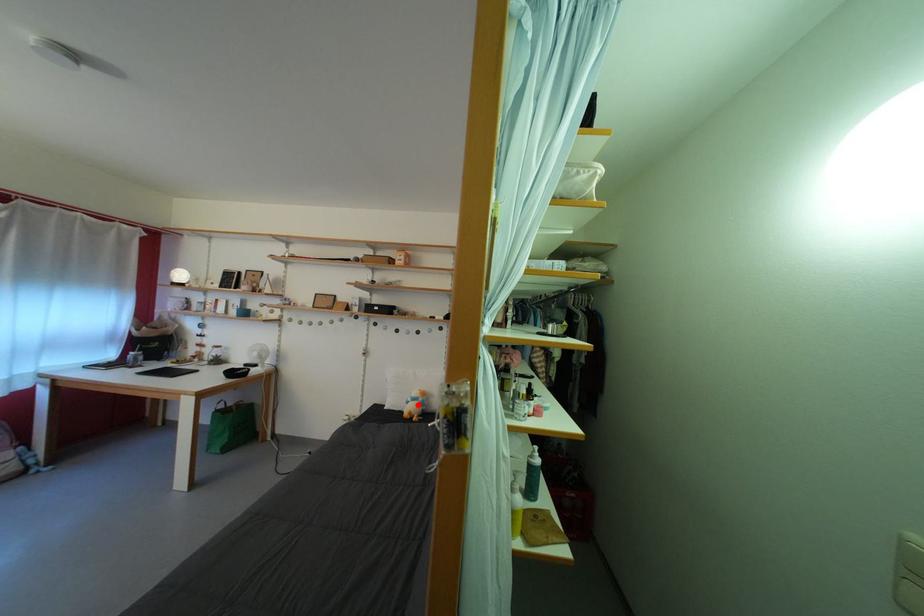
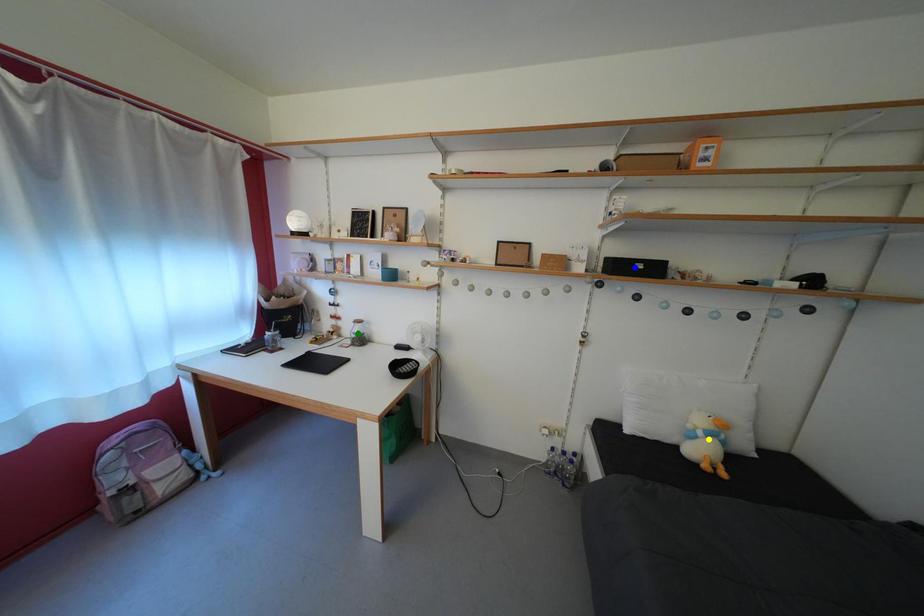
Question: I am providing you with two images of the same scene from different viewpoints. A red point is marked on the first image. You are given multiple points on the second image. Which spot in image 2 lines up with the point in image 1?

Choices:
 (A) yellow point
 (B) blue point
 (C) green point

Answer: (A)